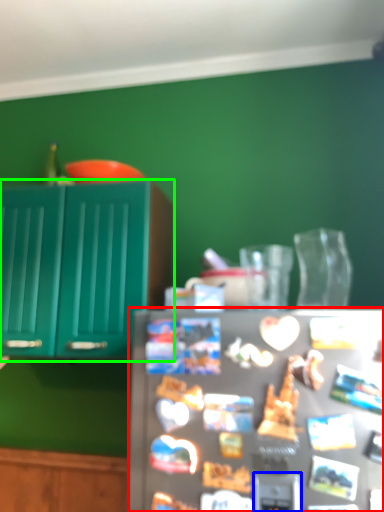
Question: Estimate the real-world distances between objects in this image. Which object is closer to refrigerator (highlighted by a red box), appliance (highlighted by a blue box) or cabinetry (highlighted by a green box)?

Choices:
 (A) appliance
 (B) cabinetry

Answer: (A)